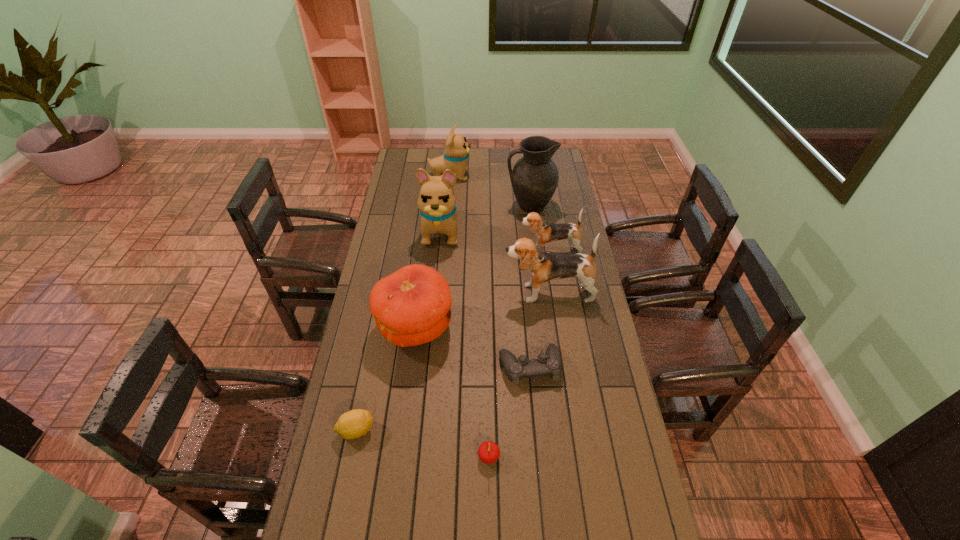
Identify the location of lemon situated at the left edge. This screenshot has width=960, height=540. (355, 423).

You are a GUI agent. You are given a task and a screenshot of the screen. Output one action in this format:
    pyautogui.click(x=<x>, y=<y>)
    Task: Click on the pitcher at the right edge
    The image size is (960, 540).
    Given the screenshot: What is the action you would take?
    pyautogui.click(x=534, y=178)

Find the location of a particular element. vacant space at the far edge of the desktop is located at coordinates (507, 158).

Locate an element on the screen. vacant region at the left edge is located at coordinates (384, 401).

Where is `vacant space at the right edge of the desktop`? The width and height of the screenshot is (960, 540). vacant space at the right edge of the desktop is located at coordinates (547, 249).

At what (x,y) coordinates should I click in order to perform the action: click on free location at the far left corner of the desktop. Please return your answer as a coordinate pair (x, y). This screenshot has height=540, width=960. Looking at the image, I should click on (423, 148).

Identify the location of empty location between the pumpkin and the control. (472, 347).

This screenshot has width=960, height=540. What are the coordinates of `unoccupied area between the control and the third shortest object` in the screenshot? It's located at (509, 411).

You are a GUI agent. You are given a task and a screenshot of the screen. Output one action in this format:
    pyautogui.click(x=<x>, y=<y>)
    Task: Click on the blank region between the control and the pumpkin
    The height and width of the screenshot is (540, 960).
    Given the screenshot: What is the action you would take?
    pyautogui.click(x=472, y=347)

At what (x,y) coordinates should I click in order to perform the action: click on vacant area that lies between the nearest puppy and the second nearest object. Please return your answer as a coordinate pair (x, y). The width and height of the screenshot is (960, 540). Looking at the image, I should click on (452, 362).